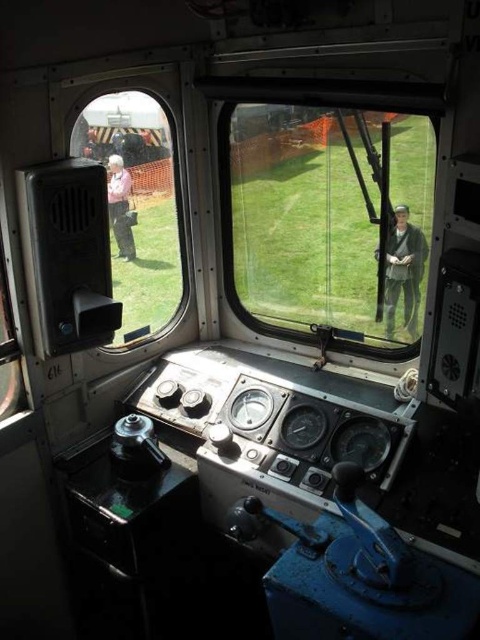
Does clear glass window at center appear over pink fabric at left?

No.

Is point (237, 179) closer to viewer compared to point (126, 196)?

No, (237, 179) is behind (126, 196).

Find the location of a particular element. This screenshot has height=640, width=480. clear glass window at center is located at coordinates (327, 220).

Is clear glass window at left positioned before pink fabric at left?

Answer: Yes.

The height and width of the screenshot is (640, 480). Identify the location of clear glass window at left. (135, 205).

Can you confirm if clear glass window at center is positioned above clear glass window at left?

Actually, clear glass window at center is below clear glass window at left.

Can you confirm if clear glass window at center is bigger than clear glass window at left?

Yes, clear glass window at center is bigger than clear glass window at left.

The height and width of the screenshot is (640, 480). I want to click on clear glass window at center, so click(327, 220).